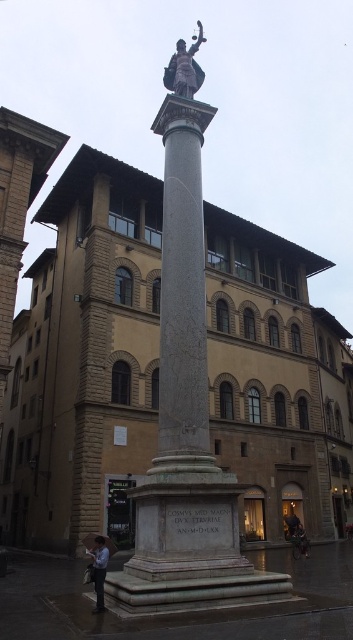
Question: Which object appears closest to the camera in this image?

Choices:
 (A) white cotton shirt at lower left
 (B) dark gray jacket at lower right

Answer: (A)

Question: Which of the following is the farthest from the observer?

Choices:
 (A) white cotton shirt at lower left
 (B) polished bronze statue at upper center
 (C) dark gray jacket at lower right

Answer: (C)

Question: Can you confirm if polished bronze statue at upper center is wider than dark gray jacket at lower right?

Choices:
 (A) no
 (B) yes

Answer: (B)

Question: Does polished bronze statue at upper center have a smaller size compared to white cotton shirt at lower left?

Choices:
 (A) no
 (B) yes

Answer: (A)

Question: Does polished bronze statue at upper center appear on the right side of white cotton shirt at lower left?

Choices:
 (A) yes
 (B) no

Answer: (A)

Question: Which of these objects is positioned closest to the white cotton shirt at lower left?

Choices:
 (A) dark gray jacket at lower right
 (B) polished bronze statue at upper center

Answer: (A)